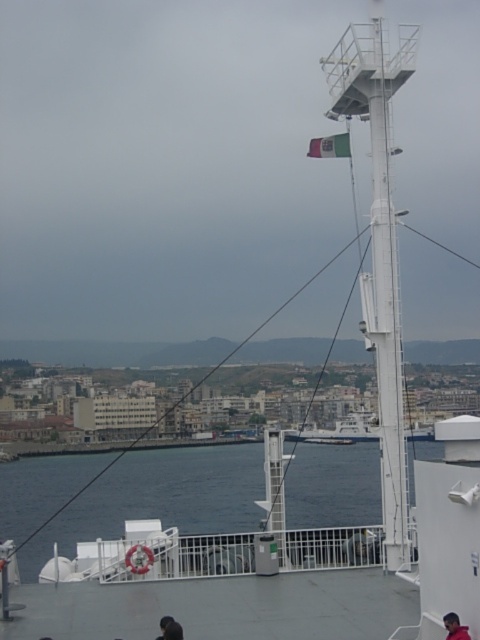
Based on the photo, you are on the ship deck and want to point out the blue water at center and the white fabric flag at upper center to a friend. Which one is located to the left of the other?

The blue water at center is positioned on the left side of white fabric flag at upper center.

You are a sailor on the ship deck. You need to determine which object takes up more space in your view between the blue water at center and the white fabric flag at upper center. Which one is larger?

The blue water at center is bigger than the white fabric flag at upper center, so the blue water at center takes up more space in the view.

You are on the deck of the ship and want to hang a new flag. The white fabric flag at upper center and the red fabric head at upper right are already present. Which object is higher in the scene?

The white fabric flag at upper center is higher than the red fabric head at upper right.